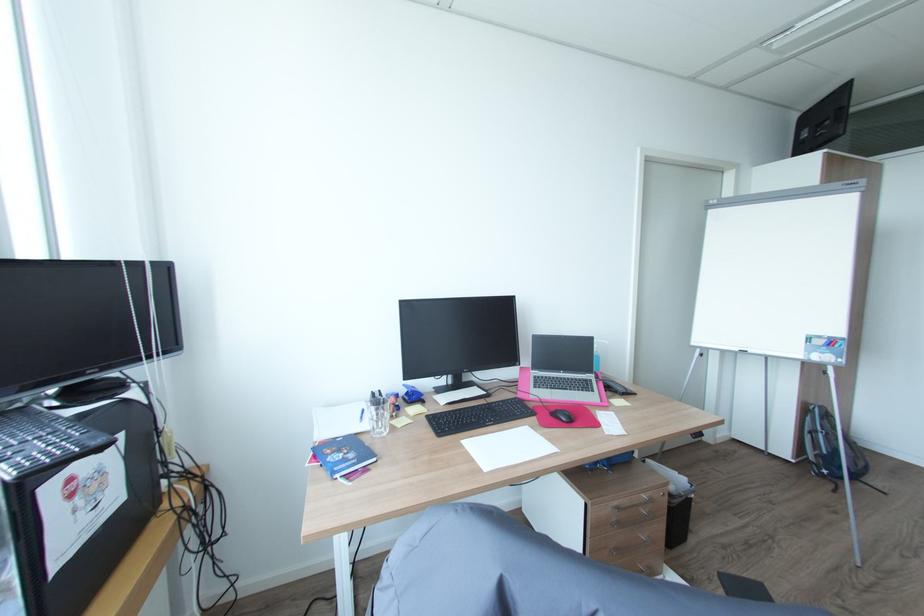
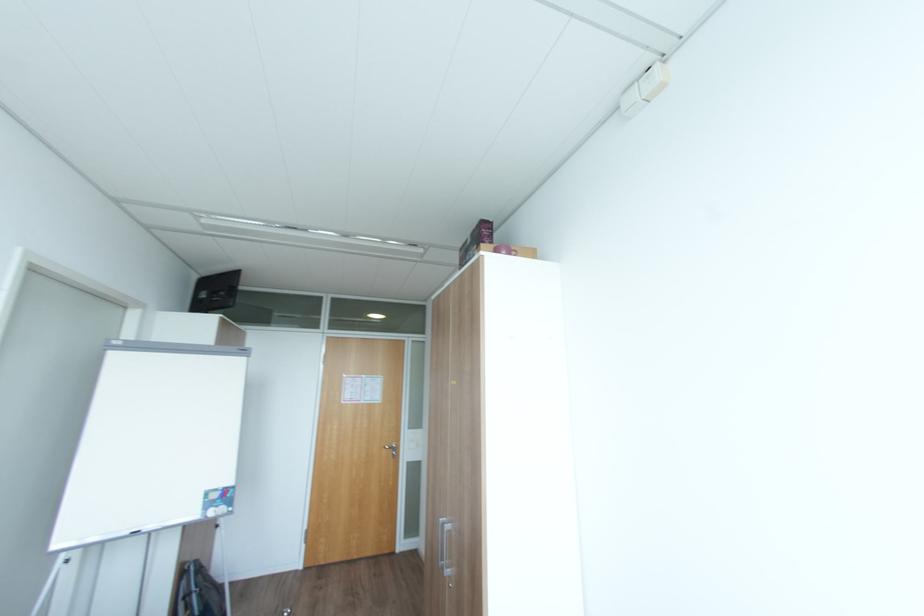
Question: The camera is either moving clockwise (left) or counter-clockwise (right) around the object. The first image is from the beginning of the video and the second image is from the end. Is the camera moving left or right when shooting the video?

Choices:
 (A) Left
 (B) Right

Answer: (A)